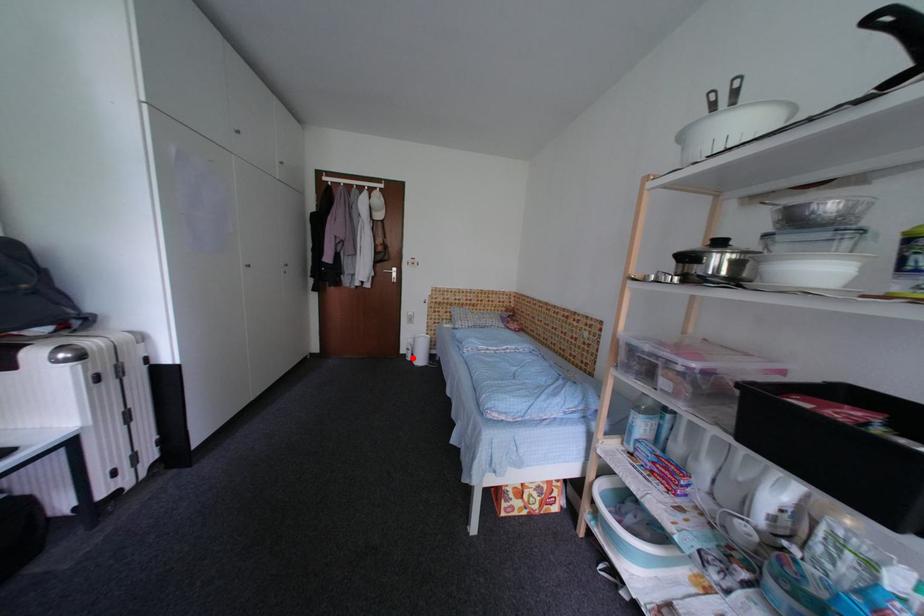
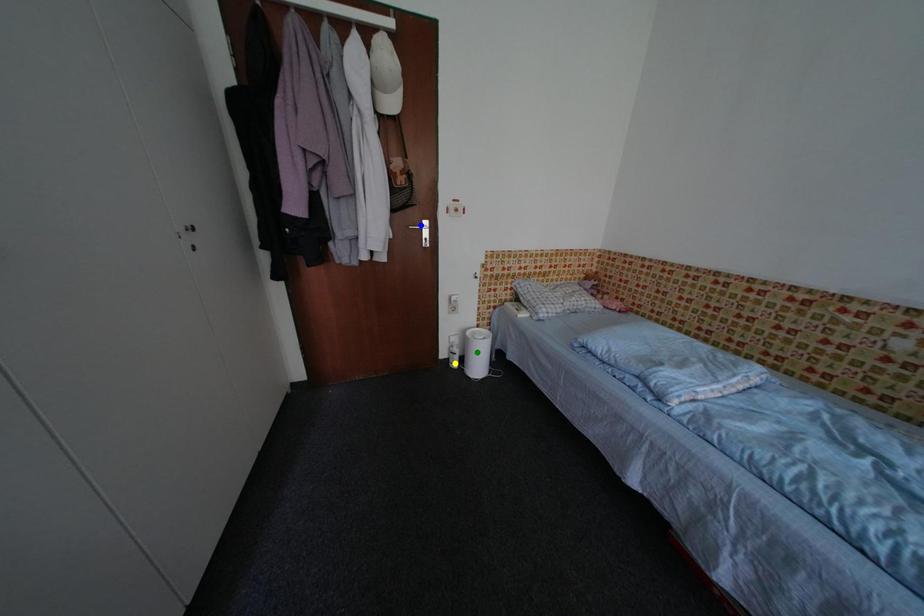
Question: I am providing you with two images of the same scene from different viewpoints. A red point is marked on the first image. You are given multiple points on the second image. Which point in image 2 represents the same 3d spot as the red point in image 1?

Choices:
 (A) blue point
 (B) yellow point
 (C) green point

Answer: (B)